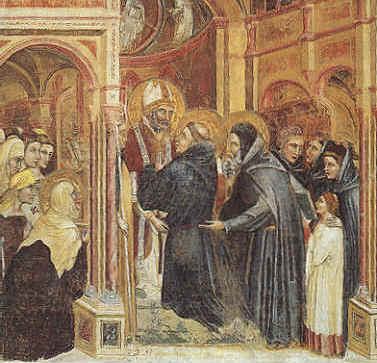
In order to click on painting in this screenshot , I will do `click(124, 261)`.